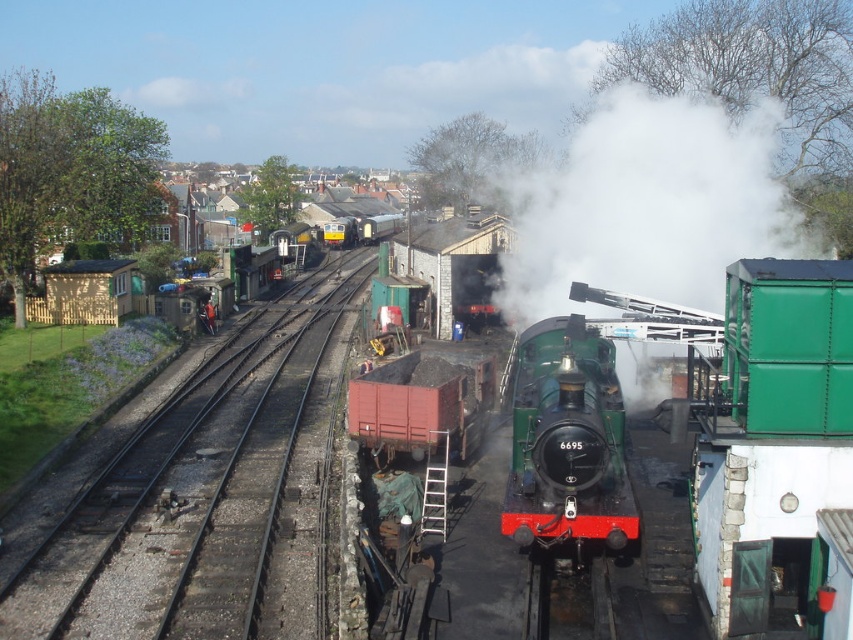
You are standing at the railway station and want to walk from point A to point B. Point A is at coordinate point (142, 472) and point B is at coordinate point (585, 412). According to the scene, which direction should you walk to move from point A to point B?

To move from point A at (142, 472) to point B at (585, 412), you should walk towards the upper left direction since point A is behind point B in the scene.

You are a railway engineer checking the track width compatibility. The black metal train track at center must accommodate the rusty metal coal car at center. Based on the scene, can the coal car fit on the track?

The black metal train track at center has a width larger than the rusty metal coal car at center, so the coal car can fit on the track since the track is wider than the car.

In the scene shown: You are a maintenance worker inspecting the railway station. You notice the black metal train track at center and the rusty metal coal car at center. Which object is closer to the ground?

The black metal train track at center is below the rusty metal coal car at center, so the black metal train track at center is closer to the ground.